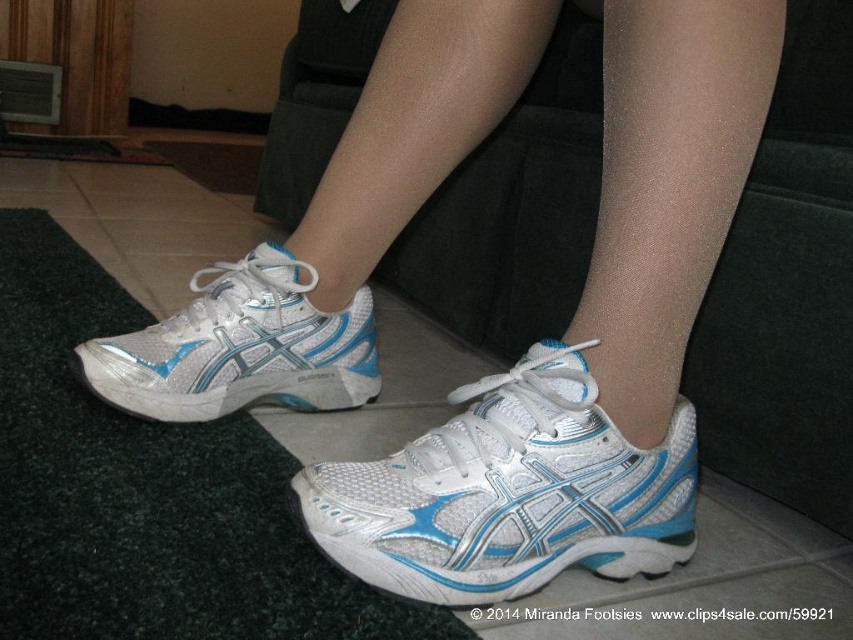
You are a photographer setting up a shoot and need to position a white mesh shoe at center precisely at point (509, 492). Can you confirm if the current position of the white mesh shoe at center matches this coordinate?

The white mesh shoe at center is located at point (509, 492), so yes, its current position matches the required coordinate.